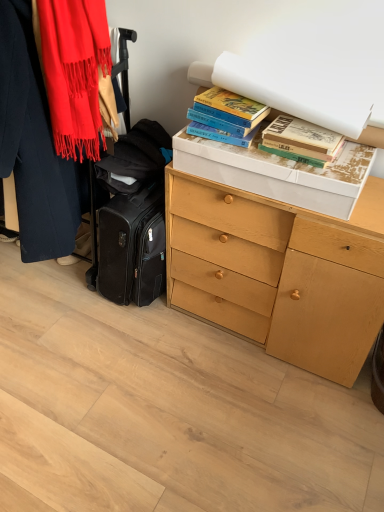
Question: From a real-world perspective, is matte red scarf at left over light wood chest of drawers at center?

Choices:
 (A) yes
 (B) no

Answer: (A)

Question: From a real-world perspective, is matte red scarf at left physically below light wood chest of drawers at center?

Choices:
 (A) yes
 (B) no

Answer: (B)

Question: From the image's perspective, is matte red scarf at left above light wood chest of drawers at center?

Choices:
 (A) yes
 (B) no

Answer: (A)

Question: Does matte red scarf at left come in front of light wood chest of drawers at center?

Choices:
 (A) yes
 (B) no

Answer: (A)

Question: Does matte red scarf at left turn towards light wood chest of drawers at center?

Choices:
 (A) yes
 (B) no

Answer: (B)

Question: Does matte red scarf at left appear on the right side of light wood chest of drawers at center?

Choices:
 (A) yes
 (B) no

Answer: (B)

Question: Is hardcover books at upper right, arranged as the 1th book when viewed from the left, not close to matte red scarf at left?

Choices:
 (A) no
 (B) yes

Answer: (A)

Question: Does hardcover books at upper right, the 2th book in the right-to-left sequence, have a lesser height compared to matte red scarf at left?

Choices:
 (A) no
 (B) yes

Answer: (B)

Question: Would you say matte red scarf at left is part of hardcover books at upper right, the 2th book in the right-to-left sequence,'s contents?

Choices:
 (A) yes
 (B) no

Answer: (B)

Question: Is hardcover books at upper right, arranged as the 1th book when viewed from the left, positioned with its back to matte red scarf at left?

Choices:
 (A) yes
 (B) no

Answer: (B)

Question: Is hardcover books at upper right, arranged as the 1th book when viewed from the left, taller than matte red scarf at left?

Choices:
 (A) no
 (B) yes

Answer: (A)

Question: Can you confirm if hardcover books at upper right, the 2th book in the right-to-left sequence, is wider than matte red scarf at left?

Choices:
 (A) yes
 (B) no

Answer: (B)

Question: Is the surface of matte red scarf at left in direct contact with hardcover books at upper right, arranged as the 1th book when viewed from the left?

Choices:
 (A) no
 (B) yes

Answer: (A)